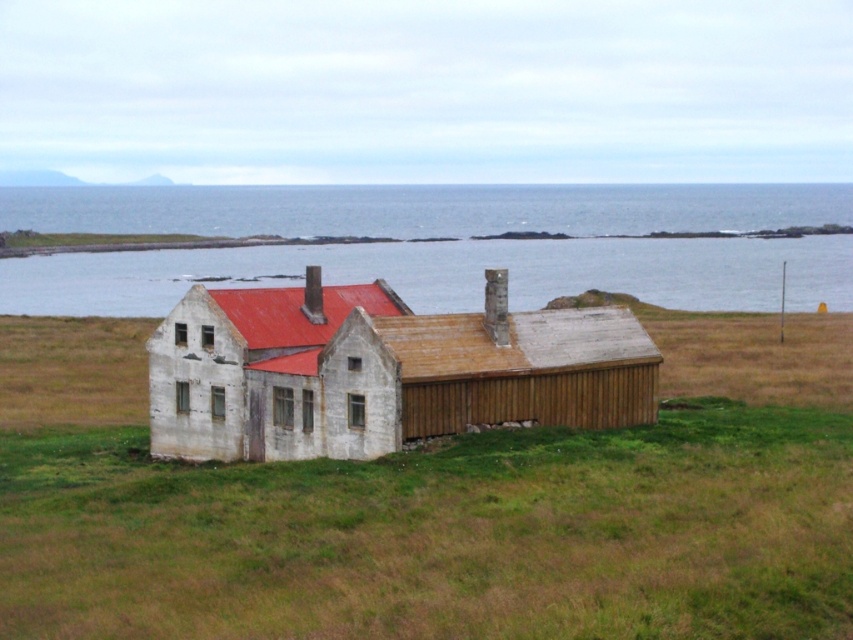
You are a photographer planning to capture the entire white wooden house at center and the transparent water at center in one frame. Given that your camera can only focus on objects within a 10m width, can both objects fit in the frame?

The transparent water at center is bigger than the white wooden house at center. However, without specific measurements of their actual sizes, it is impossible to determine if both can fit within the 10m width constraint. Additional information about their dimensions is needed to provide a definitive answer.